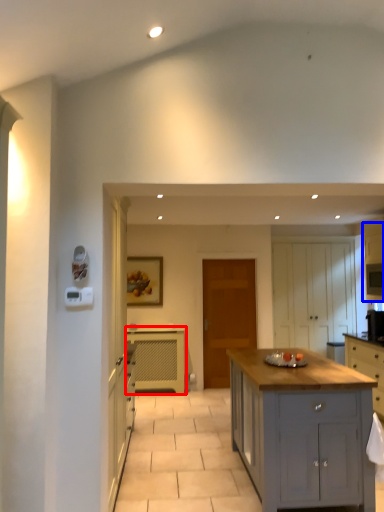
Question: Which point is closer to the camera, cabinetry (highlighted by a red box) or cabinetry (highlighted by a blue box)?

Choices:
 (A) cabinetry
 (B) cabinetry

Answer: (B)